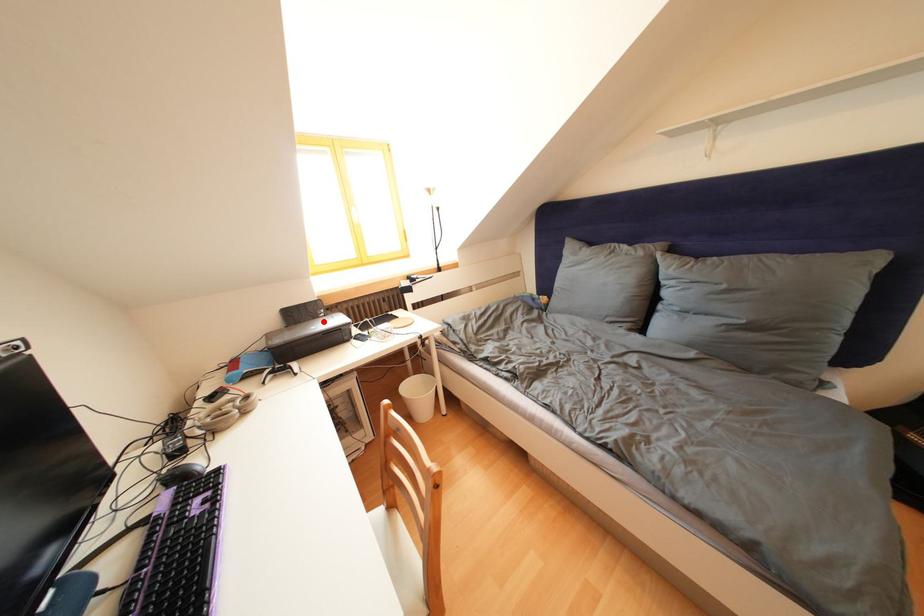
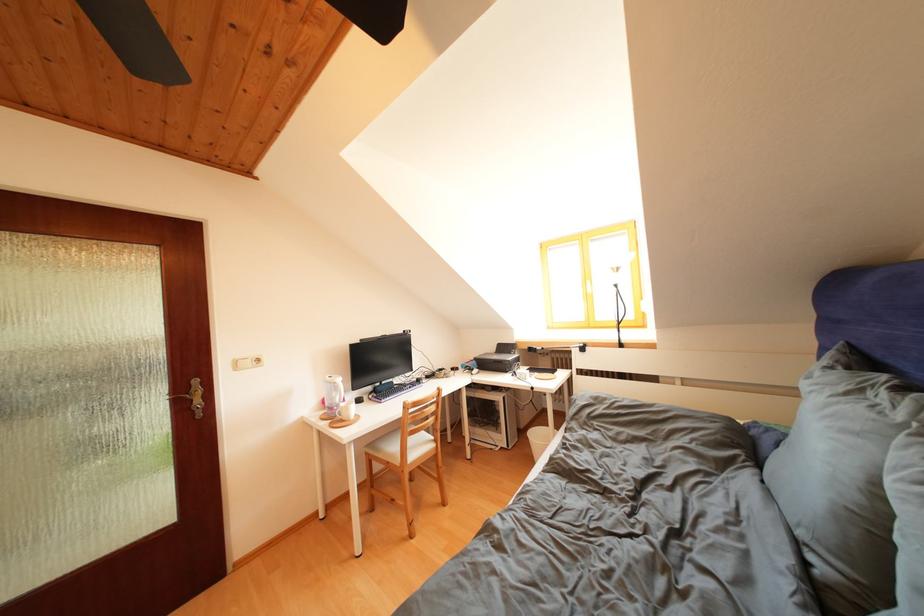
Question: I am providing you with two images of the same scene from different viewpoints. A red point is shown in image1. For the corresponding object point in image2, is it positioned nearer or farther from the camera?

Choices:
 (A) Nearer
 (B) Farther

Answer: (B)